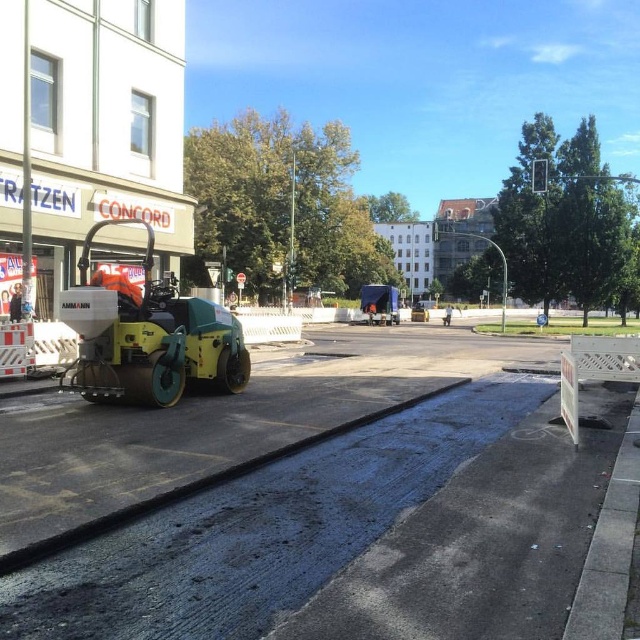
Question: Does green rubber road roller at left appear over metallic green construction vehicle at center?

Choices:
 (A) no
 (B) yes

Answer: (A)

Question: Which point is farther to the camera?

Choices:
 (A) black asphalt at lower left
 (B) green rubber road roller at left
 (C) metallic green construction vehicle at center

Answer: (C)

Question: Which point appears closest to the camera in this image?

Choices:
 (A) (449, 312)
 (B) (84, 320)
 (C) (225, 461)

Answer: (C)

Question: Does green rubber road roller at left appear on the right side of metallic green construction vehicle at center?

Choices:
 (A) yes
 (B) no

Answer: (B)

Question: Considering the relative positions of black asphalt at lower left and metallic green construction vehicle at center in the image provided, where is black asphalt at lower left located with respect to metallic green construction vehicle at center?

Choices:
 (A) above
 (B) below

Answer: (B)

Question: Estimate the real-world distances between objects in this image. Which object is farther from the orange reflective vest at center?

Choices:
 (A) black asphalt at lower left
 (B) metallic green construction vehicle at center

Answer: (A)